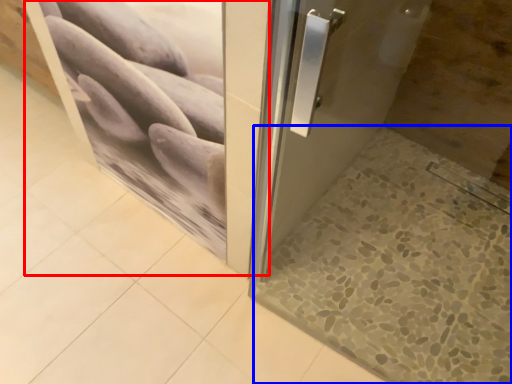
Question: Which point is closer to the camera, screen door (highlighted by a red box) or tile (highlighted by a blue box)?

Choices:
 (A) screen door
 (B) tile

Answer: (A)